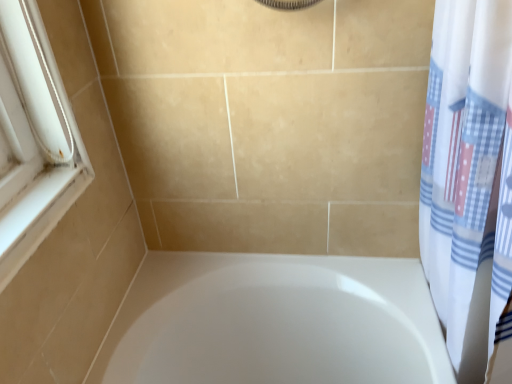
Describe the element at coordinates (464, 169) in the screenshot. The width and height of the screenshot is (512, 384). I see `white fabric curtain at right` at that location.

Where is `white fabric curtain at right`? This screenshot has height=384, width=512. white fabric curtain at right is located at coordinates (464, 169).

The height and width of the screenshot is (384, 512). In order to click on white fabric curtain at right in this screenshot , I will do `click(464, 169)`.